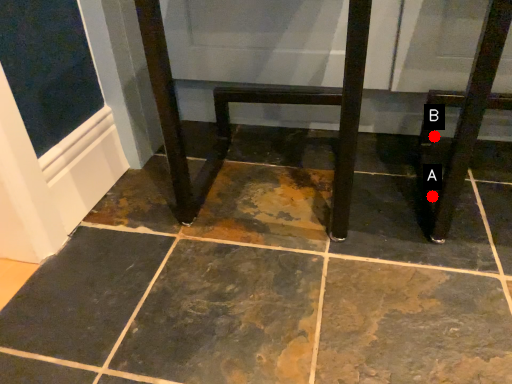
Question: Two points are circled on the image, labeled by A and B beside each circle. Among these points, which one is farthest from the camera?

Choices:
 (A) A is further
 (B) B is further

Answer: (B)